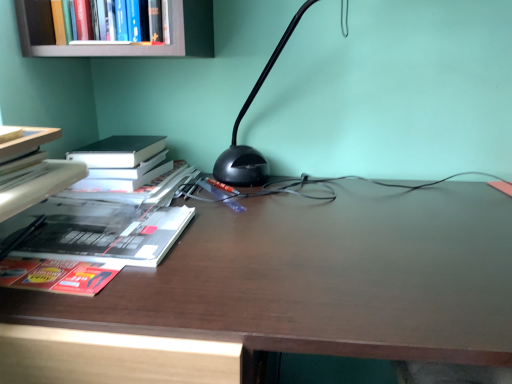
Measure the distance between point (103, 27) and camera.

Point (103, 27) and camera are 33.03 inches apart from each other.

Where is `hardcover book at left, placed as the first book when sorted from bottom to top`? The image size is (512, 384). hardcover book at left, placed as the first book when sorted from bottom to top is located at coordinates (100, 231).

Where is `hardcover book at upper left, the first book from the top`? The width and height of the screenshot is (512, 384). hardcover book at upper left, the first book from the top is located at coordinates (121, 21).

From the picture: Are black plastic lamp at center and white paper at left, the second book from the bottom, beside each other?

There is a gap between black plastic lamp at center and white paper at left, the second book from the bottom.

Based on their sizes in the image, would you say black plastic lamp at center is bigger or smaller than white paper at left, the second book from the bottom?

In the image, black plastic lamp at center appears to be larger than white paper at left, the second book from the bottom.

Who is taller, black plastic lamp at center or white paper at left, placed as the second book when sorted from top to bottom?

black plastic lamp at center.

Does black plastic lamp at center appear on the left side of white paper at left, the second book from the bottom?

In fact, black plastic lamp at center is to the right of white paper at left, the second book from the bottom.

Based on their sizes in the image, would you say dark wood desk at center is bigger or smaller than black plastic lamp at center?

Clearly, dark wood desk at center is larger in size than black plastic lamp at center.

Considering the points (501, 224) and (246, 167), which point is in front, point (501, 224) or point (246, 167)?

The point (501, 224) is closer to the camera.

Who is more distant, dark wood desk at center or black plastic lamp at center?

black plastic lamp at center is behind.

From the image's perspective, is hardcover book at left, placed as the first book when sorted from bottom to top, below black plastic lamp at center?

Indeed, from the image's perspective, hardcover book at left, placed as the first book when sorted from bottom to top, is shown beneath black plastic lamp at center.

From a real-world perspective, is hardcover book at left, acting as the 3th book starting from the top, physically located above or below black plastic lamp at center?

Clearly, from a real-world perspective, hardcover book at left, acting as the 3th book starting from the top, is below black plastic lamp at center.

Is hardcover book at left, placed as the first book when sorted from bottom to top, wider or thinner than black plastic lamp at center?

hardcover book at left, placed as the first book when sorted from bottom to top, is thinner than black plastic lamp at center.

Is point (127, 229) closer to camera compared to point (241, 163)?

That is True.

Find the location of a particular element. This screenshot has height=384, width=512. the 2nd book above the dark wood desk at center (from a real-world perspective) is located at coordinates point(41,187).

Which point is more forward, (23, 202) or (258, 244)?

The point (23, 202) is more forward.

From a real-world perspective, does white paper at left, the second book from the bottom, stand above dark wood desk at center?

Yes, from a real-world perspective, white paper at left, the second book from the bottom, is on top of dark wood desk at center.

From the image's perspective, which one is positioned higher, white paper at left, placed as the second book when sorted from top to bottom, or dark wood desk at center?

white paper at left, placed as the second book when sorted from top to bottom, appears higher in the image.

Is dark wood desk at center to the left or to the right of hardcover book at upper left, the first book from the top, in the image?

dark wood desk at center is to the right of hardcover book at upper left, the first book from the top.

Consider the image. Can you confirm if dark wood desk at center is smaller than hardcover book at upper left, the first book from the top?

Actually, dark wood desk at center might be larger than hardcover book at upper left, the first book from the top.

Between dark wood desk at center and hardcover book at upper left, the 3th book when ordered from bottom to top, which one has more height?

dark wood desk at center is taller.

Is dark wood desk at center facing away from hardcover book at upper left, the 3th book when ordered from bottom to top?

That's not correct — dark wood desk at center is not looking away from hardcover book at upper left, the 3th book when ordered from bottom to top.

How distant is white paper at left, placed as the second book when sorted from top to bottom, from black plastic lamp at center?

The distance of white paper at left, placed as the second book when sorted from top to bottom, from black plastic lamp at center is 15.91 inches.

In the image, there is a white paper at left, placed as the second book when sorted from top to bottom. Where is `lamp above it (from the image's perspective)`? lamp above it (from the image's perspective) is located at coordinates (239, 124).

Which is further, [60,190] or [250,184]?

Positioned behind is point [250,184].

Considering the relative sizes of white paper at left, placed as the second book when sorted from top to bottom, and black plastic lamp at center in the image provided, is white paper at left, placed as the second book when sorted from top to bottom, shorter than black plastic lamp at center?

Yes.

Is black plastic lamp at center oriented towards dark wood desk at center?

No, black plastic lamp at center does not turn towards dark wood desk at center.

Who is taller, black plastic lamp at center or dark wood desk at center?

Standing taller between the two is dark wood desk at center.

From a real-world perspective, is black plastic lamp at center located beneath dark wood desk at center?

No, from a real-world perspective, black plastic lamp at center is not under dark wood desk at center.

Consider the image. Is black plastic lamp at center placed right next to dark wood desk at center?

No, black plastic lamp at center is not next to dark wood desk at center.

Where is `the 1st book positioned below the black plastic lamp at center (from the image's perspective)`? the 1st book positioned below the black plastic lamp at center (from the image's perspective) is located at coordinates (41, 187).

I want to click on desk in front of the black plastic lamp at center, so click(x=322, y=278).

Looking at the image, which one is located further to black plastic lamp at center, hardcover book at left, placed as the first book when sorted from bottom to top, or dark wood desk at center?

The object further to black plastic lamp at center is dark wood desk at center.

Which object lies further to the anchor point white paper at left, the second book from the bottom, hardcover book at upper left, the 3th book when ordered from bottom to top, or black plastic lamp at center?

Based on the image, black plastic lamp at center appears to be further to white paper at left, the second book from the bottom.

From the image, which object appears to be nearer to white paper at left, the second book from the bottom, hardcover book at upper left, the 3th book when ordered from bottom to top, or hardcover book at left, placed as the first book when sorted from bottom to top?

Among the two, hardcover book at left, placed as the first book when sorted from bottom to top, is located nearer to white paper at left, the second book from the bottom.

Which object lies nearer to the anchor point hardcover book at left, acting as the 3th book starting from the top, black plastic lamp at center or dark wood desk at center?

dark wood desk at center is positioned closer to the anchor hardcover book at left, acting as the 3th book starting from the top.

Which object lies further to the anchor point white paper at left, the second book from the bottom, dark wood desk at center or hardcover book at left, acting as the 3th book starting from the top?

Among the two, dark wood desk at center is located further to white paper at left, the second book from the bottom.

When comparing their distances from hardcover book at left, acting as the 3th book starting from the top, does hardcover book at upper left, the 3th book when ordered from bottom to top, or dark wood desk at center seem further?

Among the two, hardcover book at upper left, the 3th book when ordered from bottom to top, is located further to hardcover book at left, acting as the 3th book starting from the top.

Which object lies further to the anchor point white paper at left, the second book from the bottom, dark wood desk at center or hardcover book at upper left, the 3th book when ordered from bottom to top?

Based on the image, dark wood desk at center appears to be further to white paper at left, the second book from the bottom.

Consider the image. When comparing their distances from hardcover book at upper left, the first book from the top, does hardcover book at left, acting as the 3th book starting from the top, or black plastic lamp at center seem further?

hardcover book at left, acting as the 3th book starting from the top, lies further to hardcover book at upper left, the first book from the top, than the other object.

Find the location of a particular element. This screenshot has height=384, width=512. lamp between hardcover book at upper left, the 3th book when ordered from bottom to top, and hardcover book at left, placed as the first book when sorted from bottom to top, vertically is located at coordinates (239, 124).

Where is `book between hardcover book at upper left, the first book from the top, and hardcover book at left, acting as the 3th book starting from the top, in the up-down direction`? The width and height of the screenshot is (512, 384). book between hardcover book at upper left, the first book from the top, and hardcover book at left, acting as the 3th book starting from the top, in the up-down direction is located at coordinates (41, 187).

Identify the location of lamp between white paper at left, placed as the second book when sorted from top to bottom, and dark wood desk at center. This screenshot has height=384, width=512. (239, 124).

Locate an element on the screen. The height and width of the screenshot is (384, 512). lamp that lies between hardcover book at upper left, the 3th book when ordered from bottom to top, and dark wood desk at center from top to bottom is located at coordinates (239, 124).